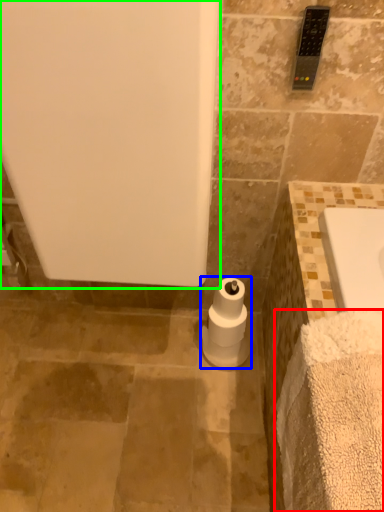
Question: Based on their relative distances, which object is farther from bath towel (highlighted by a red box)? Choose from toilet paper (highlighted by a blue box) and bath (highlighted by a green box).

Choices:
 (A) toilet paper
 (B) bath

Answer: (A)